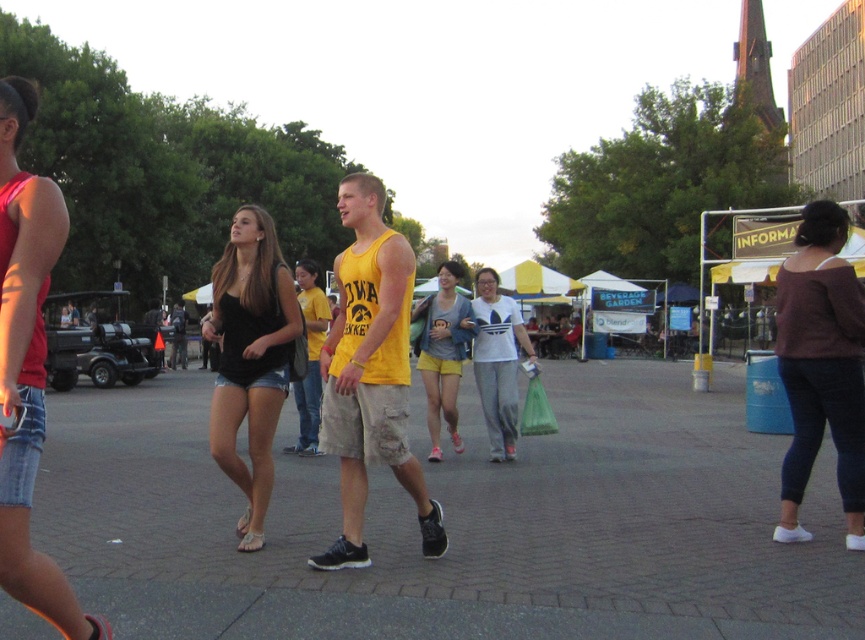
Question: Which object is the farthest from the yellow fabric shorts at center?

Choices:
 (A) dark purple sweater at right
 (B) white matte t-shirt at center
 (C) gray concrete pavement at center
 (D) denim shorts at left

Answer: (D)

Question: Is gray concrete pavement at center below denim shorts at left?

Choices:
 (A) no
 (B) yes

Answer: (B)

Question: Which point appears farthest from the camera in this image?

Choices:
 (A) (705, 625)
 (B) (389, 330)

Answer: (B)

Question: Which of the following is the closest to the observer?

Choices:
 (A) yellow fabric shorts at center
 (B) dark purple sweater at right
 (C) matte black tank top at center
 (D) denim shorts at center

Answer: (D)

Question: Is white matte t-shirt at center thinner than yellow fabric shorts at center?

Choices:
 (A) yes
 (B) no

Answer: (A)

Question: Is gray concrete pavement at center closer to camera compared to denim shorts at left?

Choices:
 (A) yes
 (B) no

Answer: (B)